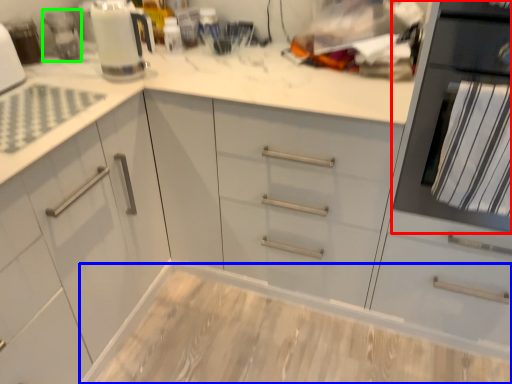
Question: Which is farther away from home appliance (highlighted by a red box)? counter (highlighted by a blue box) or appliance (highlighted by a green box)?

Choices:
 (A) counter
 (B) appliance

Answer: (B)